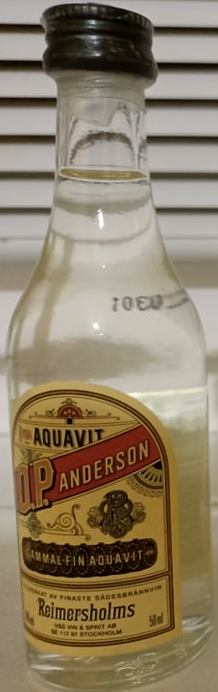
Where is `slatted shelf behind bottle`? slatted shelf behind bottle is located at coordinates (195, 21), (202, 46), (181, 162), (191, 84), (162, 125), (188, 199), (192, 228).